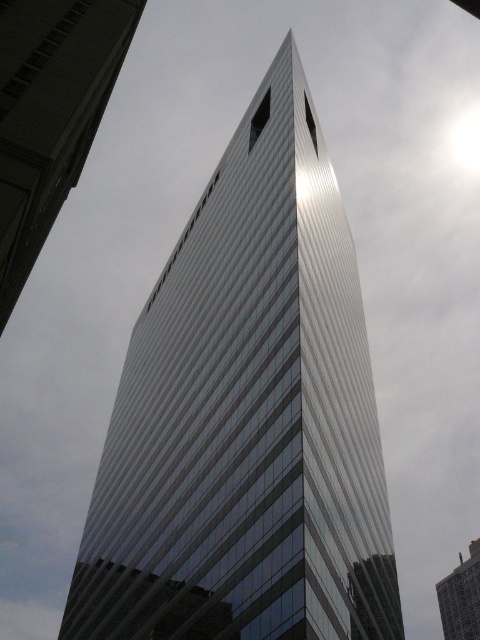
Question: Is white glass building at center to the left of white glass tower at center from the viewer's perspective?

Choices:
 (A) no
 (B) yes

Answer: (B)

Question: Is white glass building at center above white glass tower at center?

Choices:
 (A) yes
 (B) no

Answer: (A)

Question: Which object appears farthest from the camera in this image?

Choices:
 (A) white glass tower at center
 (B) white glass building at center
 (C) sleek silver skyscraper at center

Answer: (A)

Question: Does white glass building at center appear on the right side of white glass tower at center?

Choices:
 (A) yes
 (B) no

Answer: (B)

Question: Which point is closer to the camera taking this photo?

Choices:
 (A) (38, 26)
 (B) (454, 582)
 (C) (80, 596)

Answer: (A)

Question: Which object is farther from the camera taking this photo?

Choices:
 (A) white glass tower at center
 (B) sleek silver skyscraper at center
 (C) white glass building at center

Answer: (A)